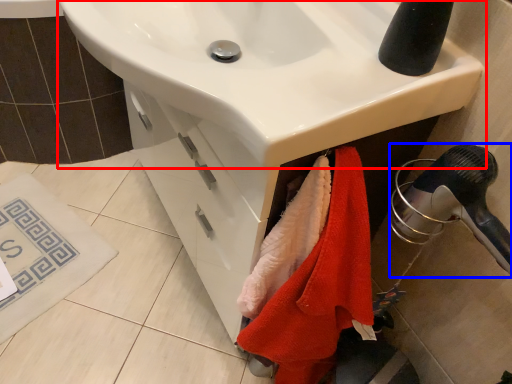
Question: Which object is further to the camera taking this photo, sink (highlighted by a red box) or hair drier (highlighted by a blue box)?

Choices:
 (A) sink
 (B) hair drier

Answer: (B)